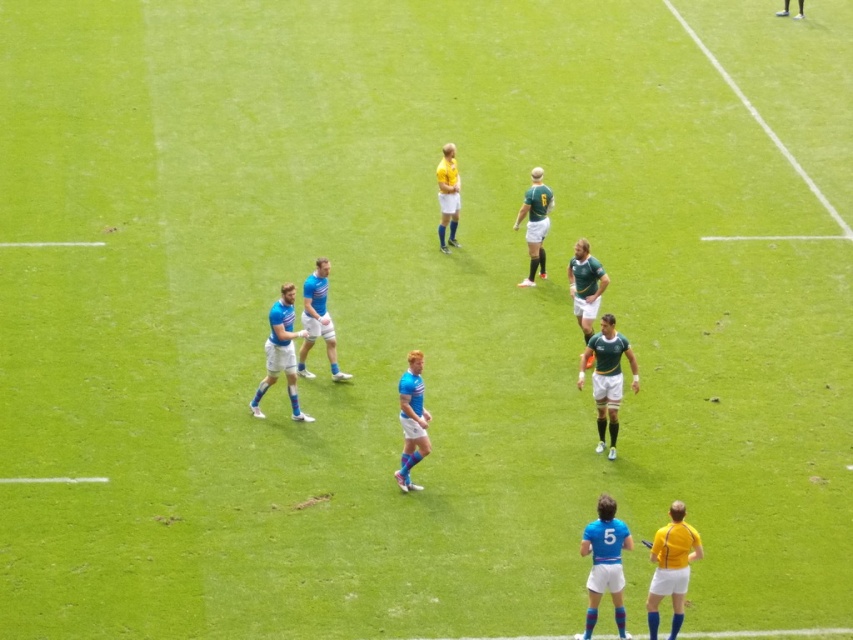
Question: Can you confirm if blue fabric jersey at center is bigger than yellow matte jersey at center?

Choices:
 (A) yes
 (B) no

Answer: (A)

Question: Which object is positioned farthest from the green jersey at center?

Choices:
 (A) blue fabric rugby team at center
 (B) blue fabric jersey at center
 (C) green matte jersey at center

Answer: (C)

Question: Can you confirm if blue fabric jersey at center is thinner than yellow matte jersey at center?

Choices:
 (A) no
 (B) yes

Answer: (A)

Question: Does blue fabric jersey at center have a larger size compared to green matte jersey at center?

Choices:
 (A) yes
 (B) no

Answer: (A)

Question: Which object is closer to the camera taking this photo?

Choices:
 (A) green jersey at center
 (B) green grass at upper right
 (C) blue fabric rugby team at center
 (D) blue fabric jersey at center

Answer: (C)

Question: Which point is farther to the camera?

Choices:
 (A) blue fabric rugby team at center
 (B) green grass at upper right

Answer: (B)